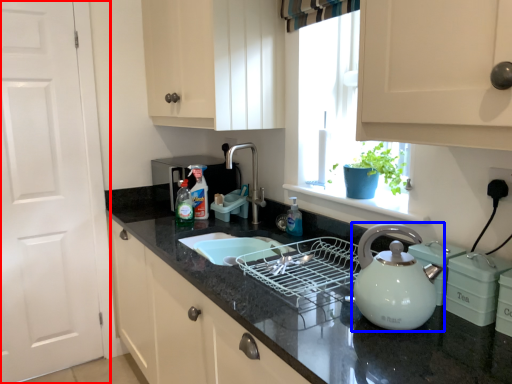
Question: Among these objects, which one is farthest to the camera, door (highlighted by a red box) or kettle (highlighted by a blue box)?

Choices:
 (A) door
 (B) kettle

Answer: (A)